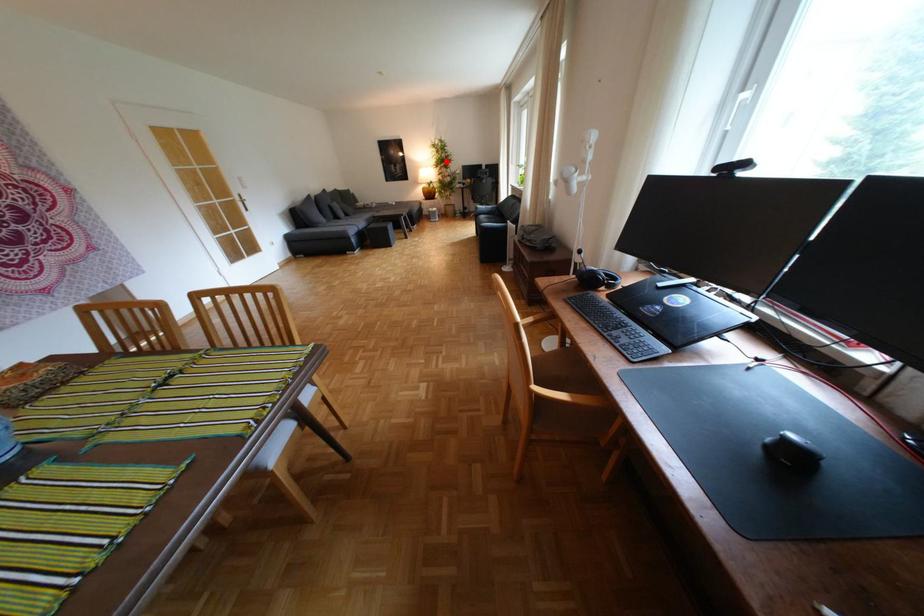
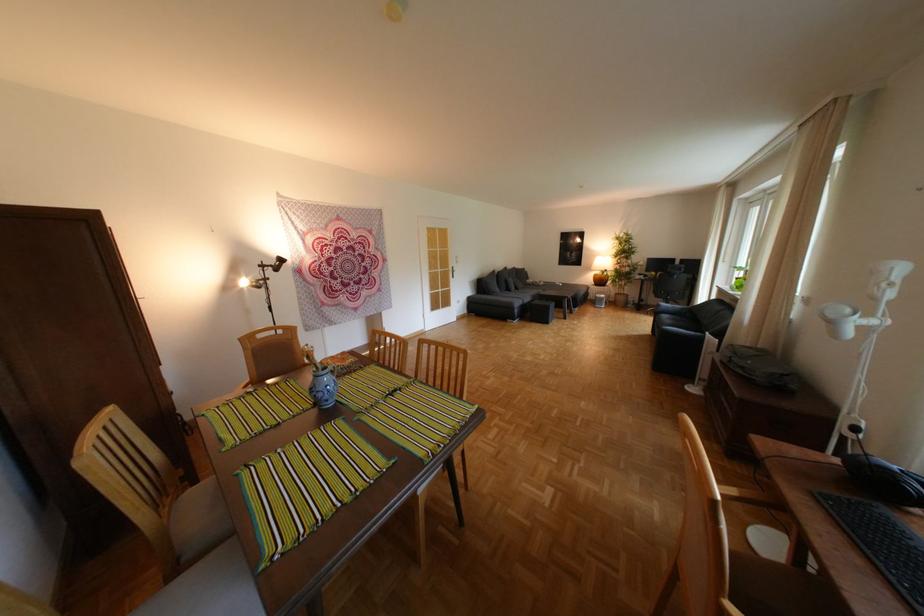
Question: I am providing you with two images of the same scene from different viewpoints. In image1, a red point is highlighted. Considering the same 3D point in image2, which of the following is correct?

Choices:
 (A) It is closer
 (B) It is farther

Answer: (B)